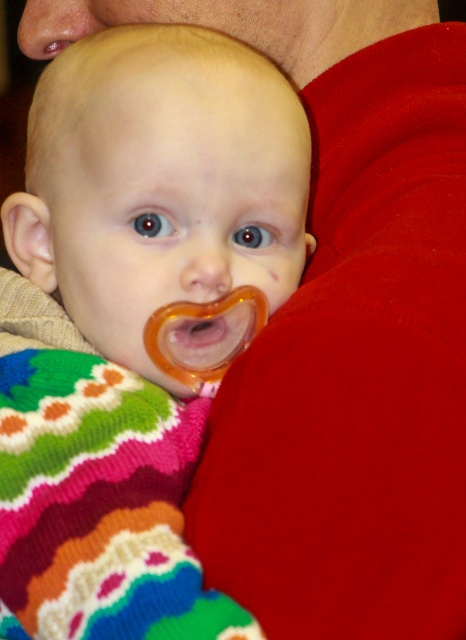
Is smooth skin nose at upper left further to camera compared to translucent orange pacifier at center?

Yes, it is behind translucent orange pacifier at center.

Who is taller, smooth skin nose at upper left or translucent orange pacifier at center?

smooth skin nose at upper left is taller.

Describe the element at coordinates (54, 26) in the screenshot. I see `smooth skin nose at upper left` at that location.

The image size is (466, 640). In order to click on smooth skin nose at upper left in this screenshot , I will do `click(54, 26)`.

Who is positioned more to the left, matte plastic pacifier at center or translucent orange pacifier at center?

Positioned to the left is matte plastic pacifier at center.

Measure the distance from matte plastic pacifier at center to translucent orange pacifier at center.

matte plastic pacifier at center is 5.54 inches from translucent orange pacifier at center.

Identify the location of matte plastic pacifier at center. This screenshot has height=640, width=466. (130, 317).

At what (x,y) coordinates should I click in order to perform the action: click on matte plastic pacifier at center. Please return your answer as a coordinate pair (x, y). The image size is (466, 640). Looking at the image, I should click on (130, 317).

Is point (200, 429) positioned behind point (45, 45)?

No, it is in front of (45, 45).

In order to click on matte plastic pacifier at center in this screenshot , I will do `click(130, 317)`.

I want to click on matte plastic pacifier at center, so click(130, 317).